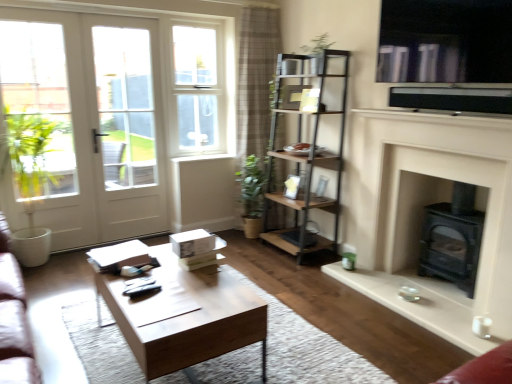
Locate an element on the screen. The width and height of the screenshot is (512, 384). free point above wooden coffee table at center (from a real-world perspective) is located at coordinates (182, 296).